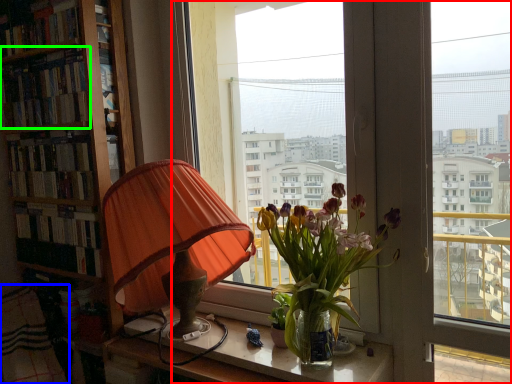
Question: Which object is the closest to the window (highlighted by a red box)? Choose among these: blanket (highlighted by a blue box) or book (highlighted by a green box).

Choices:
 (A) blanket
 (B) book

Answer: (B)